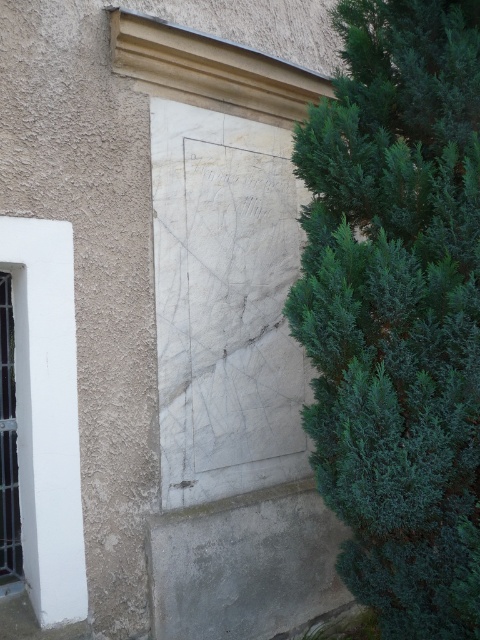
Question: Can you confirm if white matte window at left is thinner than clear glass window at left?

Choices:
 (A) no
 (B) yes

Answer: (A)

Question: Among these objects, which one is nearest to the camera?

Choices:
 (A) white matte window at left
 (B) clear glass window at left
 (C) green leafy bush at right

Answer: (C)

Question: Which object is farther from the camera taking this photo?

Choices:
 (A) green leafy bush at right
 (B) white matte window at left

Answer: (B)

Question: Which object is the closest to the white matte window at left?

Choices:
 (A) clear glass window at left
 (B) green leafy bush at right

Answer: (A)

Question: Can you confirm if white matte window at left is thinner than clear glass window at left?

Choices:
 (A) no
 (B) yes

Answer: (A)

Question: Does green leafy bush at right appear over clear glass window at left?

Choices:
 (A) no
 (B) yes

Answer: (B)